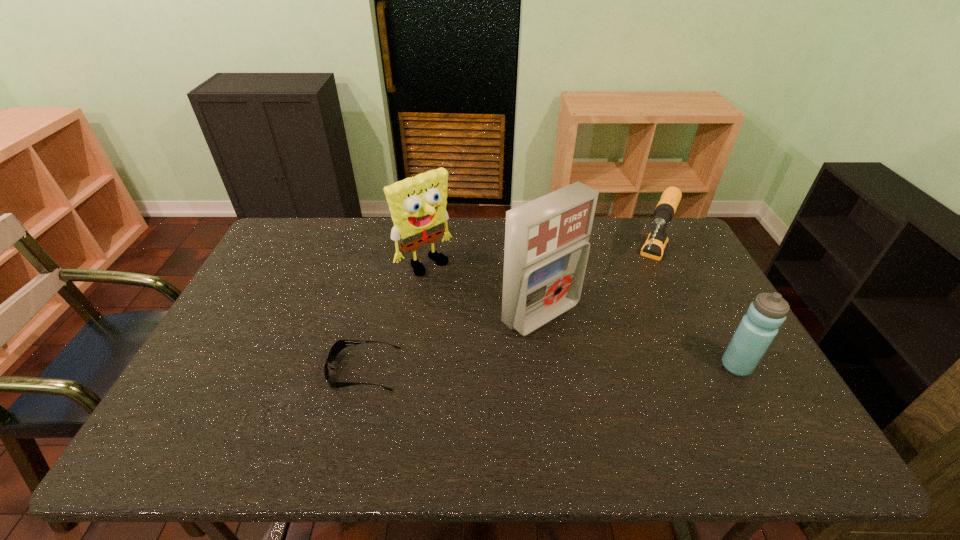
This screenshot has height=540, width=960. In the image, there is a desktop. Find the location of `vacant space at the far right corner`. vacant space at the far right corner is located at coordinates (644, 237).

In the image, there is a desktop. At what (x,y) coordinates should I click in order to perform the action: click on vacant area at the near right corner. Please return your answer as a coordinate pair (x, y). Looking at the image, I should click on (785, 405).

At what (x,y) coordinates should I click in order to perform the action: click on free spot between the shortest object and the sponge. Please return your answer as a coordinate pair (x, y). Looking at the image, I should click on pyautogui.click(x=395, y=316).

Where is `vacant region between the third object from left to right and the sponge`? The image size is (960, 540). vacant region between the third object from left to right and the sponge is located at coordinates (x=483, y=288).

Image resolution: width=960 pixels, height=540 pixels. In order to click on unoccupied position between the sponge and the water bottle in this screenshot , I will do `click(581, 314)`.

Where is `vacant area that lies between the tallest object and the third shortest object`? The width and height of the screenshot is (960, 540). vacant area that lies between the tallest object and the third shortest object is located at coordinates (638, 340).

Find the location of a particular element. This screenshot has width=960, height=540. object identified as the closest to the sunglasses is located at coordinates (547, 246).

Select which object appears as the third closest to the tallest object. Please provide its 2D coordinates. Your answer should be formatted as a tuple, i.e. [(x, y)], where the tuple contains the x and y coordinates of a point satisfying the conditions above.

[(338, 346)]

Identify the location of free space that satisfies the following two spatial constraints: 1. on the front side of the third shortest object; 2. on the right side of the first-aid kit. (548, 366).

At what (x,y) coordinates should I click in order to perform the action: click on free region that satisfies the following two spatial constraints: 1. on the front side of the water bottle; 2. on the left side of the third object from right to left. Please return your answer as a coordinate pair (x, y). The image size is (960, 540). Looking at the image, I should click on (548, 366).